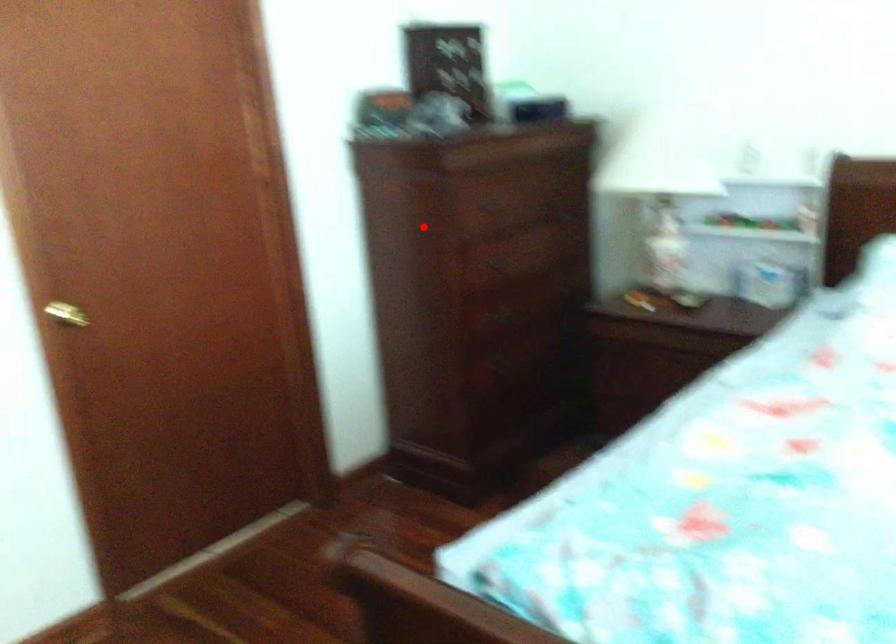
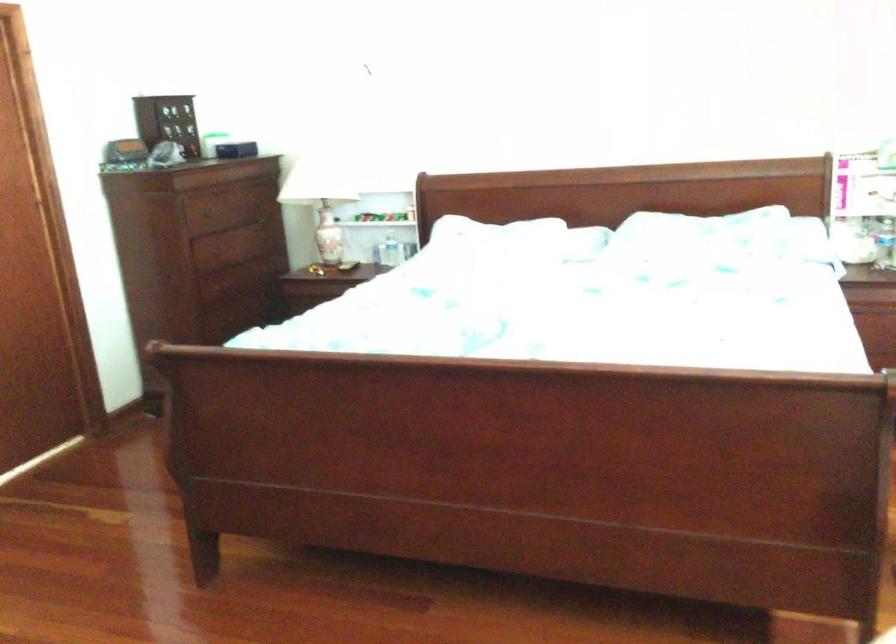
Question: I am providing you with two images of the same scene from different viewpoints. In image1, a red point is highlighted. Considering the same 3D point in image2, which of the following is correct?

Choices:
 (A) It is closer
 (B) It is farther

Answer: (B)